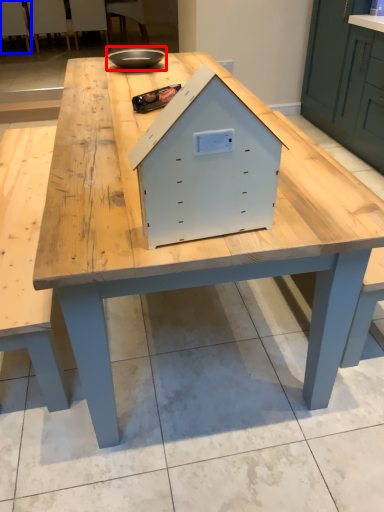
Question: Which point is further to the camera, bowl (highlighted by a red box) or chair (highlighted by a blue box)?

Choices:
 (A) bowl
 (B) chair

Answer: (B)